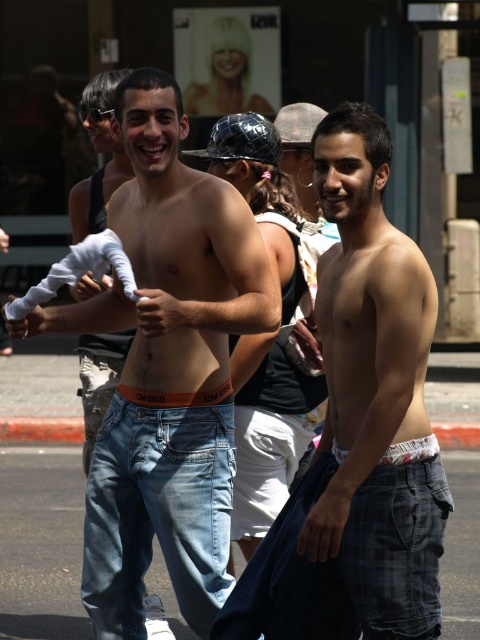
Is point (264, 266) in front of point (403, 444)?

That is False.

Is orange fabric underwear at center closer to the viewer compared to white cotton underwear at lower right?

That is False.

Where is `orange fabric underwear at center`? orange fabric underwear at center is located at coordinates (167, 371).

The width and height of the screenshot is (480, 640). What are the coordinates of `orange fabric underwear at center` in the screenshot? It's located at (167, 371).

Is white cotton shorts at center bigger than jeans at center?

Indeed, white cotton shorts at center has a larger size compared to jeans at center.

Which is in front, point (349, 493) or point (100, 170)?

Point (349, 493) is more forward.

Where is `white cotton shorts at center`? Image resolution: width=480 pixels, height=640 pixels. white cotton shorts at center is located at coordinates (373, 396).

Is point (384, 516) closer to viewer compared to point (117, 560)?

That is True.

Between white cotton shorts at center and light blue denim jeans at center, which one is positioned higher?

white cotton shorts at center

You are a GUI agent. You are given a task and a screenshot of the screen. Output one action in this format:
    pyautogui.click(x=<x>, y=<y>)
    Task: Click on the white cotton shorts at center
    This screenshot has height=640, width=480.
    Given the screenshot: What is the action you would take?
    [x=373, y=396]

The image size is (480, 640). In order to click on white cotton shorts at center in this screenshot , I will do `click(373, 396)`.